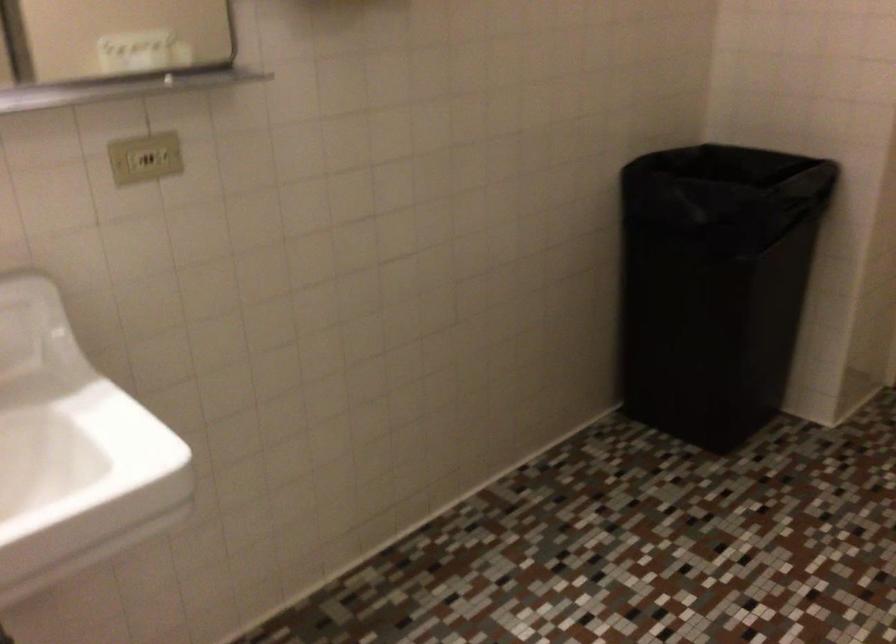
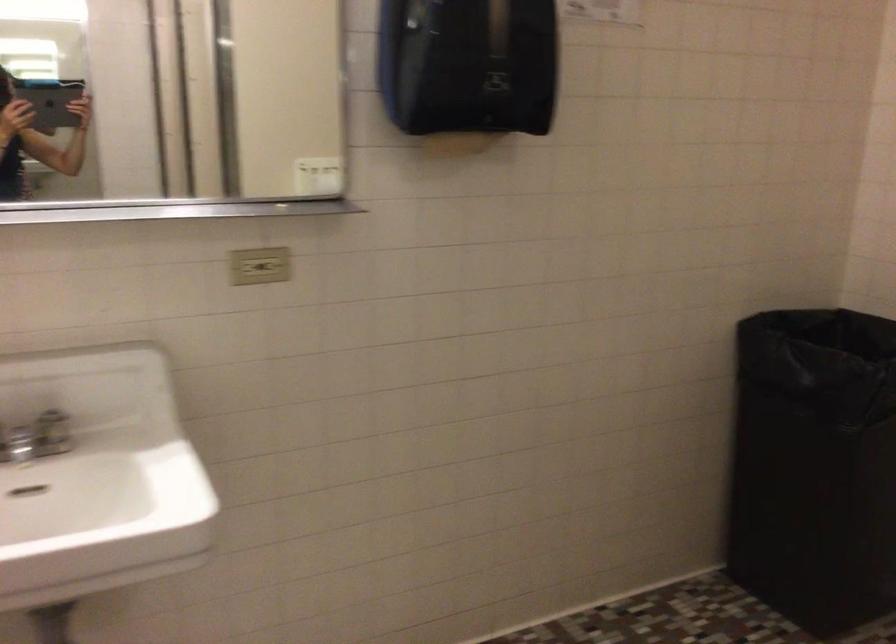
In the second image, find the point that corresponds to the point at 165,160 in the first image.

(273, 266)